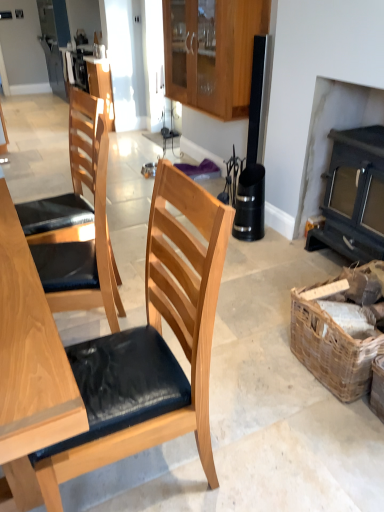
Question: Considering the positions of point (94, 71) and point (82, 208), is point (94, 71) closer or farther from the camera than point (82, 208)?

Choices:
 (A) closer
 (B) farther

Answer: (B)

Question: Looking at the image, does matte wood cabinet at upper center, which ranks as the 2th cabinetry in front-to-back order, seem bigger or smaller compared to light brown wood chair at left, which appears as the 2th chair when ordered from the bottom?

Choices:
 (A) small
 (B) big

Answer: (A)

Question: Which object is positioned farthest from the matte wood cabinet at upper center, the first cabinetry in the back-to-front sequence?

Choices:
 (A) light brown wood chair at left, which appears as the 2th chair when ordered from the bottom
 (B) woven brown picnic basket at lower right
 (C) wooden cabinet at upper center, which is the first cabinetry from right to left
 (D) wooden chair with cushion at center, which is the 1th chair from bottom to top
 (E) dark gray wood fireplace at right

Answer: (C)

Question: Which is nearer to the woven brown picnic basket at lower right?

Choices:
 (A) dark gray wood fireplace at right
 (B) matte wood cabinet at upper center, arranged as the first cabinetry when viewed from the left
 (C) light brown wood chair at left, which appears as the 2th chair when ordered from the bottom
 (D) wooden cabinet at upper center, placed as the first cabinetry when sorted from front to back
 (E) wooden chair with cushion at center, which is the 1th chair from bottom to top

Answer: (E)